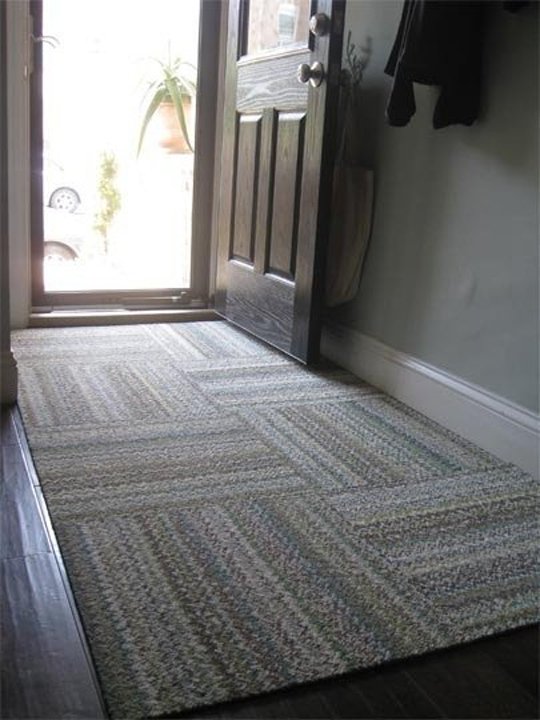
The image size is (540, 720). In order to click on garment hanging from wall in this screenshot , I will do pyautogui.click(x=433, y=40).